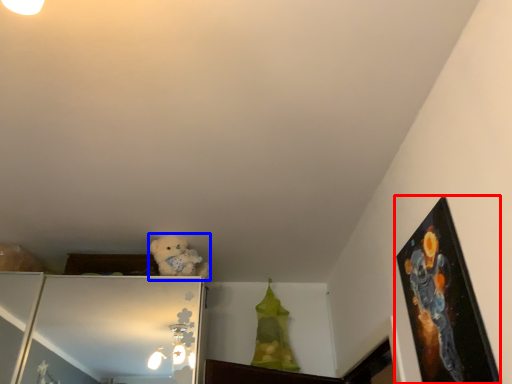
Question: Which object is closer to the camera taking this photo, picture frame (highlighted by a red box) or animal (highlighted by a blue box)?

Choices:
 (A) picture frame
 (B) animal

Answer: (A)